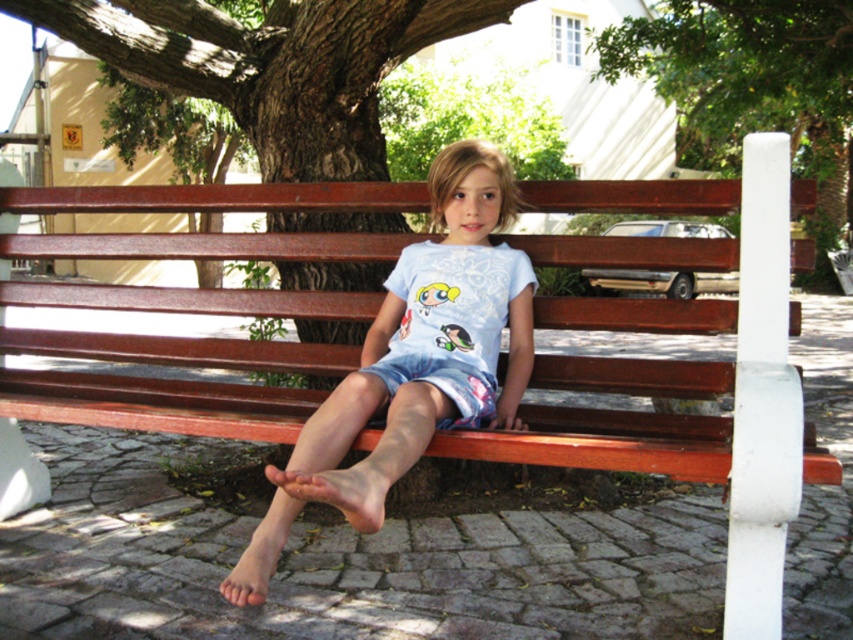
Can you confirm if light blue cotton shirt at center is smaller than green leafy tree at upper center?

Indeed, light blue cotton shirt at center has a smaller size compared to green leafy tree at upper center.

Who is more distant from viewer, (x=509, y=424) or (x=621, y=29)?

Positioned behind is point (x=621, y=29).

Does point (445, 259) come closer to viewer compared to point (695, 29)?

Yes, it is in front of point (695, 29).

Identify the location of light blue cotton shirt at center. This screenshot has width=853, height=640. (415, 362).